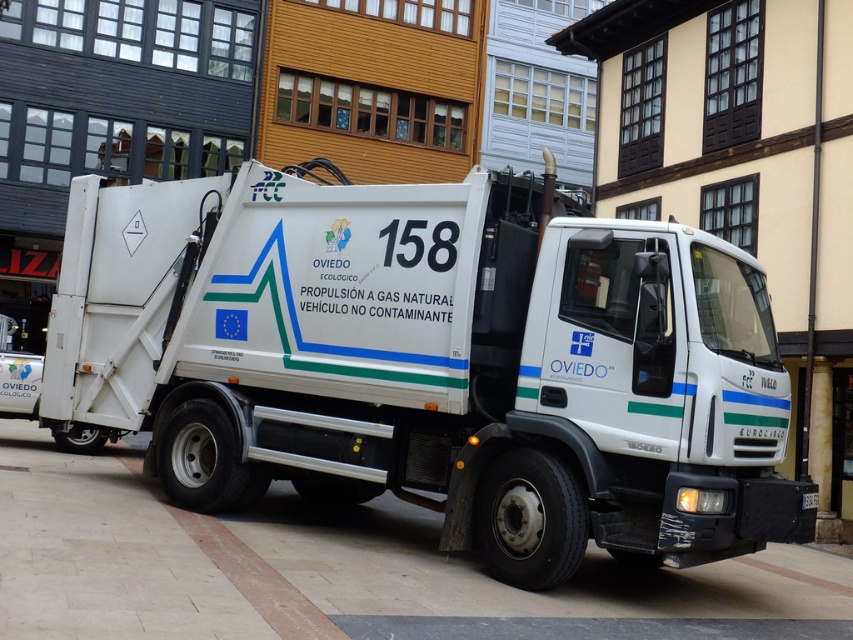
Can you confirm if white matte truck at center is smaller than white tile pavement at center?

Yes.

Can you confirm if white matte truck at center is taller than white tile pavement at center?

No, white matte truck at center is not taller than white tile pavement at center.

Is point (392, 273) positioned behind point (223, 589)?

Yes.

Locate an element on the screen. The height and width of the screenshot is (640, 853). white matte truck at center is located at coordinates tap(432, 362).